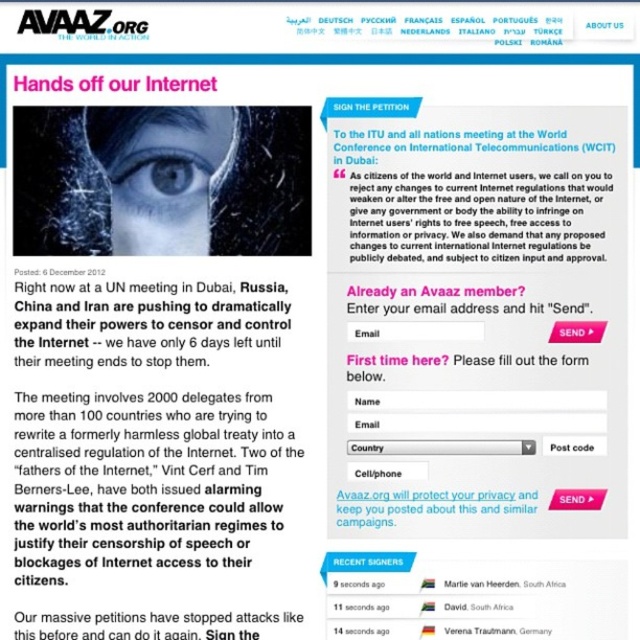
Question: Which object is the farthest from the white paper text at upper center?

Choices:
 (A) black paper text at lower center
 (B) blue glassy eye at center

Answer: (A)

Question: Which point appears farthest from the camera in this image?

Choices:
 (A) (394, 225)
 (B) (232, 621)
 (C) (157, 186)

Answer: (A)

Question: Is white paper text at upper center in front of black paper text at lower center?

Choices:
 (A) yes
 (B) no

Answer: (B)

Question: Is white paper text at upper center to the left of black paper text at lower center from the viewer's perspective?

Choices:
 (A) no
 (B) yes

Answer: (A)

Question: Can you confirm if white paper text at upper center is wider than blue glassy eye at center?

Choices:
 (A) yes
 (B) no

Answer: (A)

Question: Which of these objects is positioned closest to the black paper text at lower center?

Choices:
 (A) white paper text at upper center
 (B) blue glassy eye at center

Answer: (B)